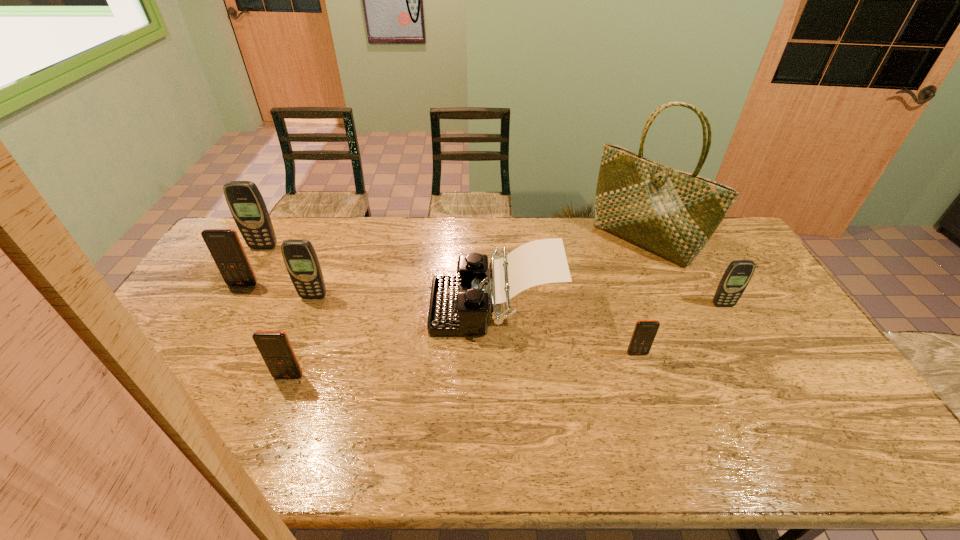
Identify the location of free space located on the keys of the typewriter. The width and height of the screenshot is (960, 540). (333, 306).

Where is `free space located on the keys of the typewriter`? free space located on the keys of the typewriter is located at coordinates [399, 306].

Locate an element on the screen. blank area located on the screen of the rightmost gray cellular telephone is located at coordinates (774, 395).

I want to click on vacant area situated on the screen of the nearest orange cellular telephone, so click(260, 451).

Where is `vacant area situated on the screen of the smallest orange cellular telephone`? vacant area situated on the screen of the smallest orange cellular telephone is located at coordinates (668, 447).

Where is `shopping bag positioned at the far edge`? shopping bag positioned at the far edge is located at coordinates (671, 213).

The image size is (960, 540). I want to click on cellular telephone present at the far edge, so click(x=247, y=206).

Locate an element on the screen. This screenshot has height=540, width=960. object located at the right edge is located at coordinates (736, 277).

Where is `object that is at the far left corner`? This screenshot has width=960, height=540. object that is at the far left corner is located at coordinates (247, 206).

The image size is (960, 540). Identify the location of vacant point at the far edge. (486, 225).